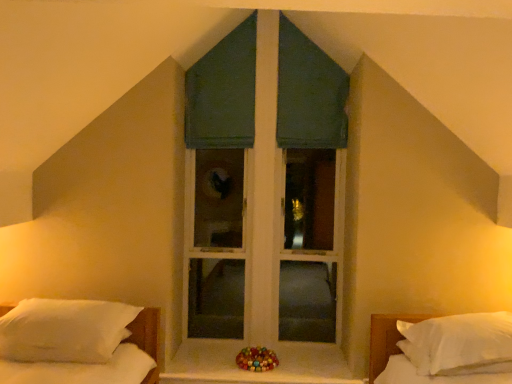
This screenshot has width=512, height=384. What are the coordinates of `free location to the left of shiny multicolored beads at center` in the screenshot? It's located at (220, 366).